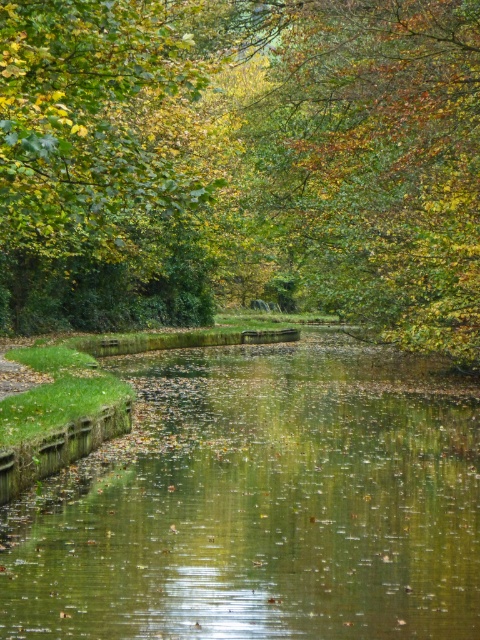
Question: Which object is closer to the camera taking this photo?

Choices:
 (A) green reflective water at center
 (B) green leafy tree at upper center
 (C) green leafy tree at center

Answer: (A)

Question: Is green reflective water at center further to the viewer compared to green leafy tree at upper center?

Choices:
 (A) yes
 (B) no

Answer: (B)

Question: Which object is the closest to the green leafy tree at upper center?

Choices:
 (A) green reflective water at center
 (B) green leafy tree at center

Answer: (B)

Question: Is green leafy tree at center below green leafy tree at upper center?

Choices:
 (A) no
 (B) yes

Answer: (A)

Question: Does green reflective water at center lie behind green leafy tree at upper center?

Choices:
 (A) no
 (B) yes

Answer: (A)

Question: Which point is farther to the camera?

Choices:
 (A) (13, 259)
 (B) (76, 492)

Answer: (A)